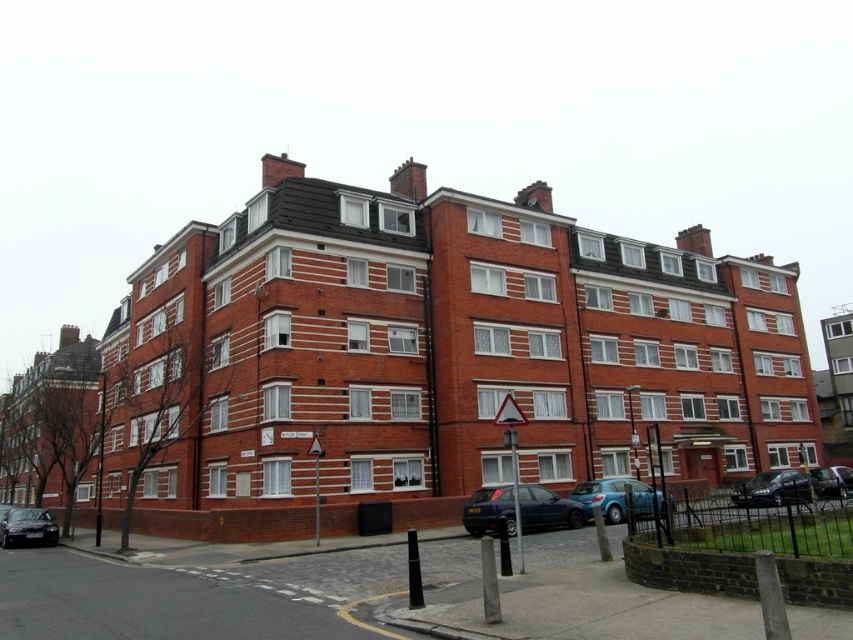
Question: Which point is farther to the camera?

Choices:
 (A) (782, 480)
 (B) (44, 508)
 (C) (659, 508)

Answer: (B)

Question: Is blue metallic car at lower right to the left of shiny black sedan at lower left from the viewer's perspective?

Choices:
 (A) yes
 (B) no

Answer: (B)

Question: Observing the image, what is the correct spatial positioning of blue metallic car at lower right in reference to shiny black sedan at lower left?

Choices:
 (A) right
 (B) left

Answer: (A)

Question: Does matte black car at center appear over blue metallic car at lower right?

Choices:
 (A) no
 (B) yes

Answer: (B)

Question: Which of the following is the farthest from the observer?

Choices:
 (A) (622, 477)
 (B) (3, 531)
 (C) (525, 490)
 (D) (801, 497)

Answer: (A)

Question: Which point is closer to the camera taking this photo?

Choices:
 (A) (618, 504)
 (B) (749, 497)
 (C) (531, 506)
 (D) (42, 516)

Answer: (C)